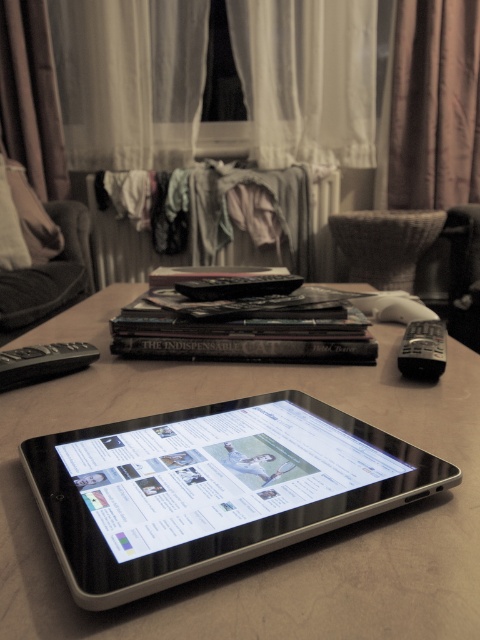
Is satin black tablet at center shorter than black plastic remote at left?

In fact, satin black tablet at center may be taller than black plastic remote at left.

Which is more to the left, satin black tablet at center or black plastic remote at left?

black plastic remote at left

At what (x,y) coordinates should I click in order to perform the action: click on satin black tablet at center. Please return your answer as a coordinate pair (x, y). Image resolution: width=480 pixels, height=640 pixels. Looking at the image, I should click on (279, 550).

Who is more distant from viewer, (67, 355) or (432, 340)?

Positioned behind is point (432, 340).

This screenshot has height=640, width=480. What do you see at coordinates (43, 362) in the screenshot?
I see `black plastic remote at left` at bounding box center [43, 362].

What are the coordinates of `black plastic remote at left` in the screenshot? It's located at [43, 362].

Is satin black tablet at center below black plastic remote at center?

Yes, satin black tablet at center is below black plastic remote at center.

Does satin black tablet at center have a lesser height compared to black plastic remote at center?

No.

What are the coordinates of `satin black tablet at center` in the screenshot? It's located at (279, 550).